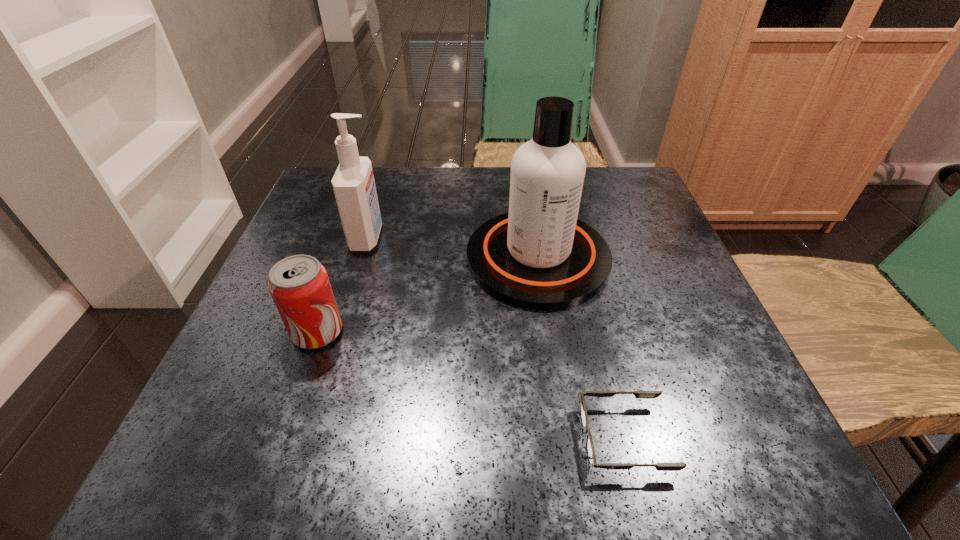
The height and width of the screenshot is (540, 960). I want to click on free space between the second nearest object and the right cleansing agent, so click(x=427, y=295).

Locate an element on the screen. The height and width of the screenshot is (540, 960). free space between the third farthest object and the right cleansing agent is located at coordinates (427, 295).

Where is `empty space between the right cleansing agent and the shorter cleansing agent`? The image size is (960, 540). empty space between the right cleansing agent and the shorter cleansing agent is located at coordinates [x=453, y=248].

Locate an element on the screen. This screenshot has width=960, height=540. empty space that is in between the right cleansing agent and the left cleansing agent is located at coordinates [453, 248].

The image size is (960, 540). What are the coordinates of `vacant space that's between the nearest object and the left cleansing agent` in the screenshot? It's located at (495, 338).

Locate an element on the screen. free space between the shortest object and the left cleansing agent is located at coordinates (495, 338).

Identify which object is the second closest to the third farthest object. Please provide its 2D coordinates. Your answer should be formatted as a tuple, i.e. [(x, y)], where the tuple contains the x and y coordinates of a point satisfying the conditions above.

[(539, 256)]

I want to click on object that is the third closest to the second nearest object, so click(x=590, y=451).

This screenshot has width=960, height=540. I want to click on vacant region that satisfies the following two spatial constraints: 1. on the front label of the right cleansing agent; 2. on the left side of the shorter cleansing agent, so click(362, 258).